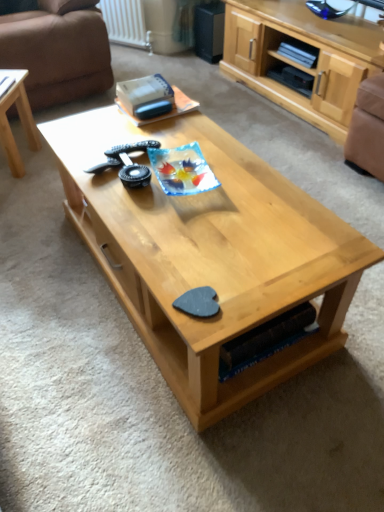
Question: From the image's perspective, does natural wood coffee table at center, the 1th coffee table viewed from the right, appear higher than brown fabric armchair at right?

Choices:
 (A) no
 (B) yes

Answer: (A)

Question: Considering the relative sizes of natural wood coffee table at center, the 1th coffee table viewed from the right, and brown fabric armchair at right in the image provided, is natural wood coffee table at center, the 1th coffee table viewed from the right, taller than brown fabric armchair at right?

Choices:
 (A) no
 (B) yes

Answer: (A)

Question: Can you confirm if natural wood coffee table at center, the 1th coffee table viewed from the right, is positioned to the right of brown fabric armchair at right?

Choices:
 (A) no
 (B) yes

Answer: (A)

Question: From a real-world perspective, is natural wood coffee table at center, the 1th coffee table viewed from the right, on top of brown fabric armchair at right?

Choices:
 (A) no
 (B) yes

Answer: (A)

Question: Considering the relative sizes of natural wood coffee table at center, the 1th coffee table viewed from the right, and brown fabric armchair at right in the image provided, is natural wood coffee table at center, the 1th coffee table viewed from the right, shorter than brown fabric armchair at right?

Choices:
 (A) yes
 (B) no

Answer: (A)

Question: Does point (246, 150) appear closer or farther from the camera than point (38, 144)?

Choices:
 (A) farther
 (B) closer

Answer: (B)

Question: From a real-world perspective, is natural wood coffee table at center, which is the 2th coffee table in left-to-right order, positioned above or below light wood/texture coffee table at left, which is the 1th coffee table in left-to-right order?

Choices:
 (A) above
 (B) below

Answer: (A)

Question: In terms of height, does natural wood coffee table at center, the 1th coffee table viewed from the right, look taller or shorter compared to light wood/texture coffee table at left, which is the second coffee table from right to left?

Choices:
 (A) short
 (B) tall

Answer: (B)

Question: From the image's perspective, is natural wood coffee table at center, the 1th coffee table viewed from the right, located above or below light wood/texture coffee table at left, which is the second coffee table from right to left?

Choices:
 (A) above
 (B) below

Answer: (B)

Question: Considering their positions, is brown leather couch at upper left located in front of or behind light wood cabinet at upper right?

Choices:
 (A) behind
 (B) front

Answer: (A)

Question: Does point (38, 37) appear closer or farther from the camera than point (251, 77)?

Choices:
 (A) closer
 (B) farther

Answer: (A)

Question: From a real-world perspective, is brown leather couch at upper left physically located above or below light wood cabinet at upper right?

Choices:
 (A) above
 (B) below

Answer: (A)

Question: From the image's perspective, is brown leather couch at upper left above or below light wood cabinet at upper right?

Choices:
 (A) below
 (B) above

Answer: (B)

Question: Is brown fabric armchair at right inside or outside of natural wood coffee table at center, the 1th coffee table viewed from the right?

Choices:
 (A) inside
 (B) outside

Answer: (B)

Question: Considering the positions of brown fabric armchair at right and natural wood coffee table at center, the 1th coffee table viewed from the right, in the image, is brown fabric armchair at right taller or shorter than natural wood coffee table at center, the 1th coffee table viewed from the right,?

Choices:
 (A) tall
 (B) short

Answer: (A)